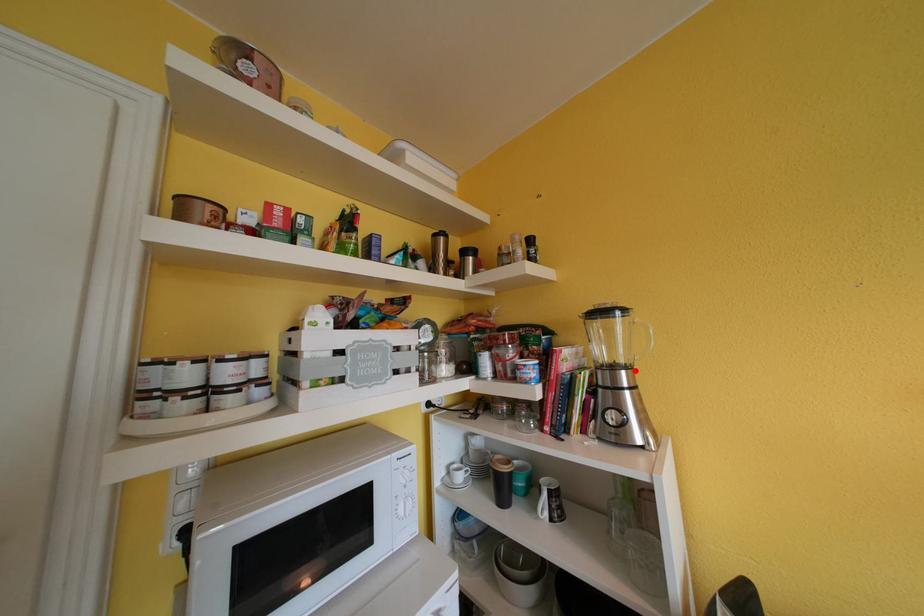
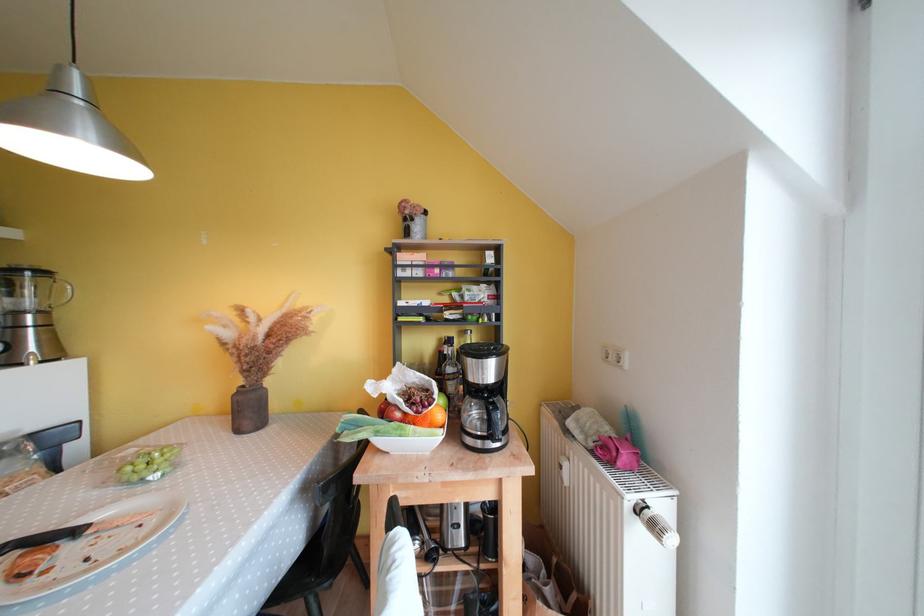
Locate, in the second image, the point that corresponds to the highlighted location in the first image.

(49, 315)